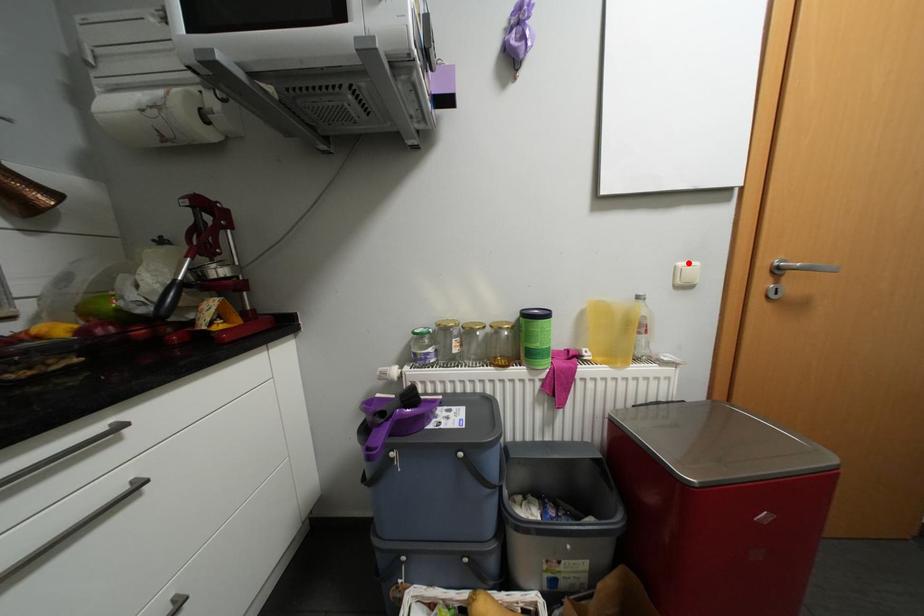
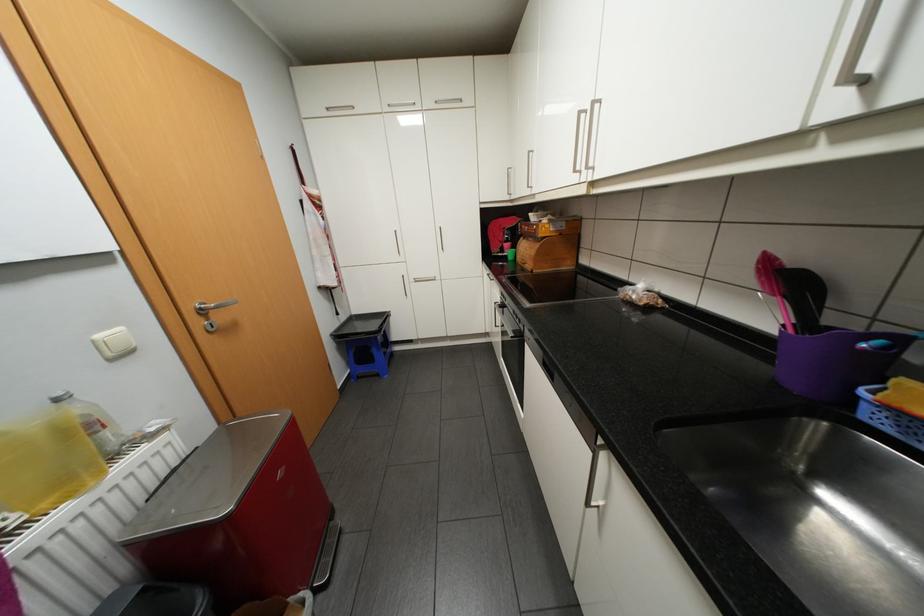
In the second image, find the point that corresponds to the highlighted location in the first image.

(106, 334)